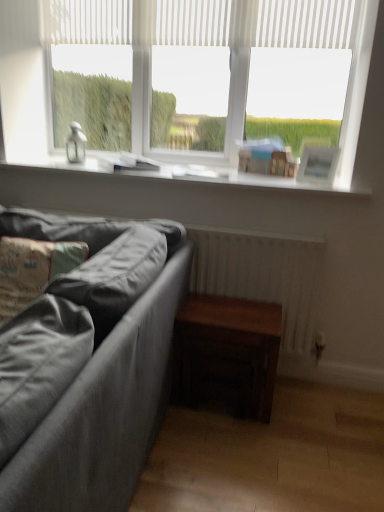
Question: Which is correct: textured gray fabric couch at lower left is inside white matte window at upper center, or outside of it?

Choices:
 (A) inside
 (B) outside

Answer: (B)

Question: In terms of width, does textured gray fabric couch at lower left look wider or thinner when compared to white matte window at upper center?

Choices:
 (A) wide
 (B) thin

Answer: (A)

Question: Which is farther from the textured gray fabric couch at lower left?

Choices:
 (A) white matte window at upper center
 (B) white smooth window sill at upper center
 (C) dark wood table at lower right
 (D) textured gray pillow at lower left

Answer: (A)

Question: Which is nearer to the dark wood table at lower right?

Choices:
 (A) white matte window at upper center
 (B) textured gray pillow at lower left
 (C) white smooth window sill at upper center
 (D) textured gray fabric couch at lower left

Answer: (D)